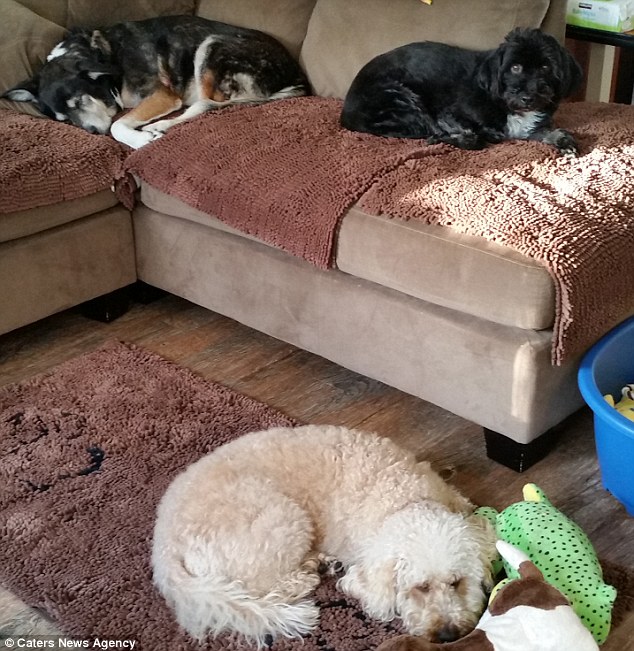
Image resolution: width=634 pixels, height=651 pixels. Find the location of `rug`. rug is located at coordinates (112, 493).